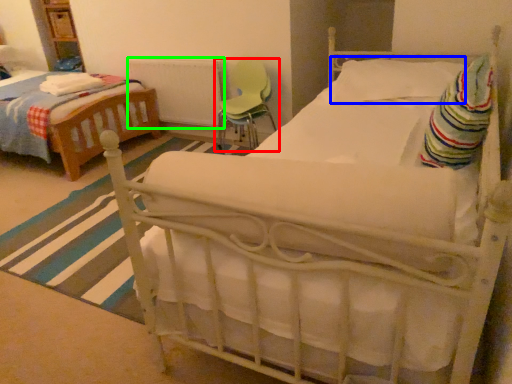
Question: Considering the real-world distances, which object is closest to chair (highlighted by a red box)? pillow (highlighted by a blue box) or radiator (highlighted by a green box).

Choices:
 (A) pillow
 (B) radiator

Answer: (B)